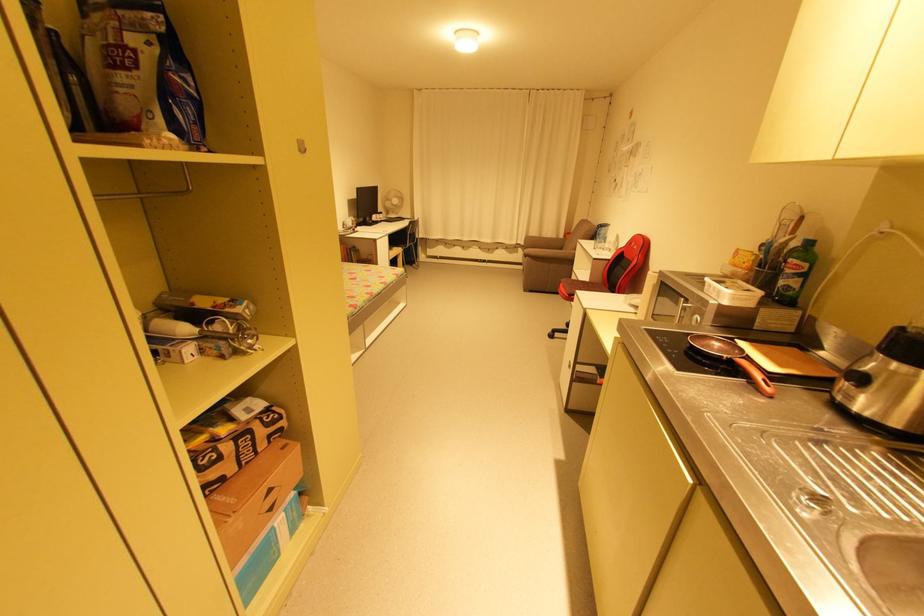
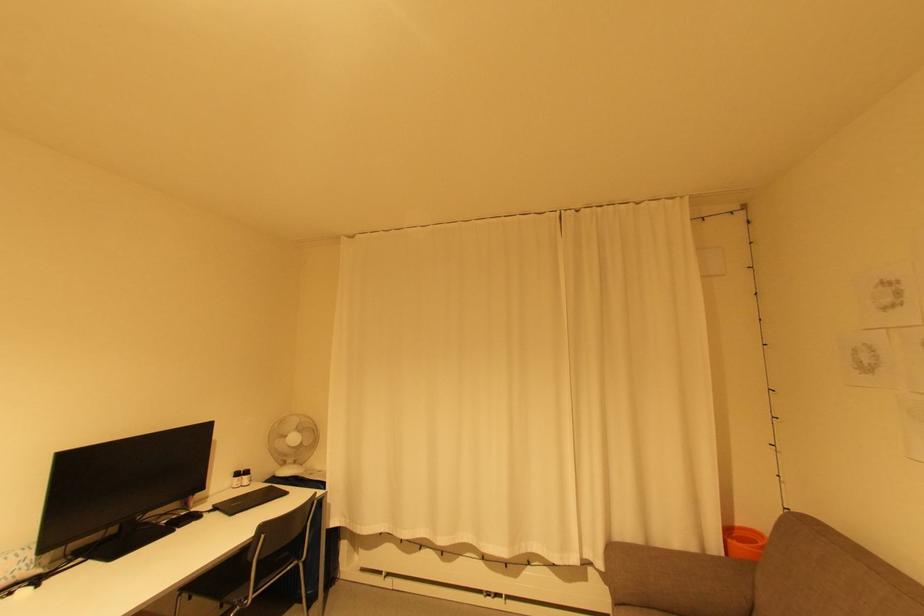
Locate, in the second image, the point that corresponds to the point at 414,233 in the first image.

(262, 562)